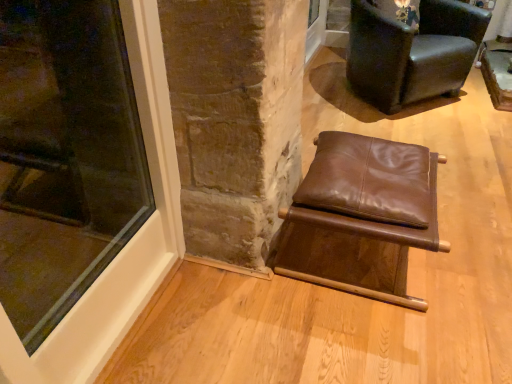
Find the location of a particular element. free space to the right of brown leather stool at center, the 1th chair from the front is located at coordinates (470, 240).